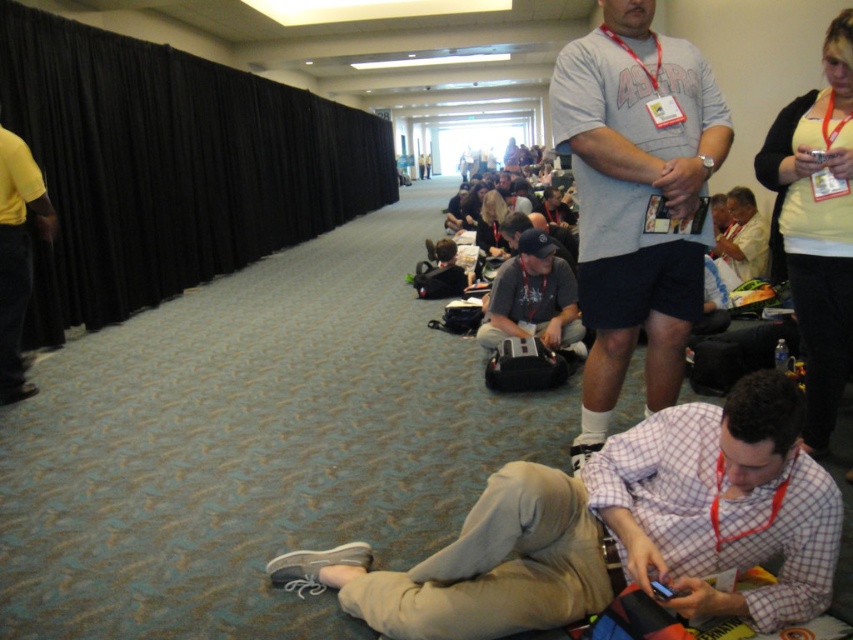
Does point (781, 390) come closer to viewer compared to point (744, 195)?

That is True.

Does plaid shirt at lower center have a lesser height compared to light beige shirt at center?

Yes, plaid shirt at lower center is shorter than light beige shirt at center.

Find the location of a particular element. This screenshot has height=640, width=853. plaid shirt at lower center is located at coordinates (624, 529).

Can you confirm if yellow t-shirt at left is positioned above light beige shirt at center?

No, yellow t-shirt at left is not above light beige shirt at center.

Is yellow t-shirt at left to the left of light beige shirt at center from the viewer's perspective?

Yes, yellow t-shirt at left is to the left of light beige shirt at center.

Is point (15, 400) farther from viewer compared to point (749, 212)?

No, (15, 400) is in front of (749, 212).

Where is `yellow t-shirt at left`? The height and width of the screenshot is (640, 853). yellow t-shirt at left is located at coordinates (16, 256).

Which is more to the right, dark gray fabric cap at center or light beige shirt at center?

From the viewer's perspective, light beige shirt at center appears more on the right side.

Between point (566, 280) and point (718, 236), which one is positioned in front?

Point (566, 280) is more forward.

Find the location of a particular element. Image resolution: width=853 pixels, height=640 pixels. dark gray fabric cap at center is located at coordinates (532, 296).